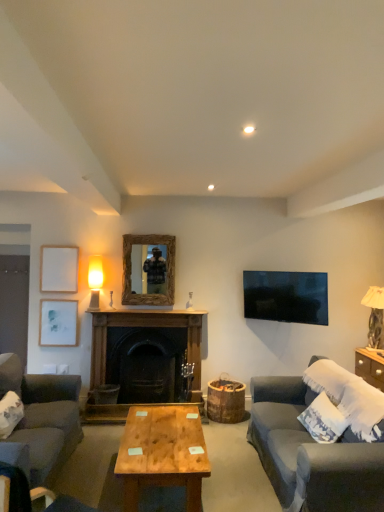
Where is `free space above natural wood coffee table at center (from a real-world perspective)`? free space above natural wood coffee table at center (from a real-world perspective) is located at coordinates (165, 440).